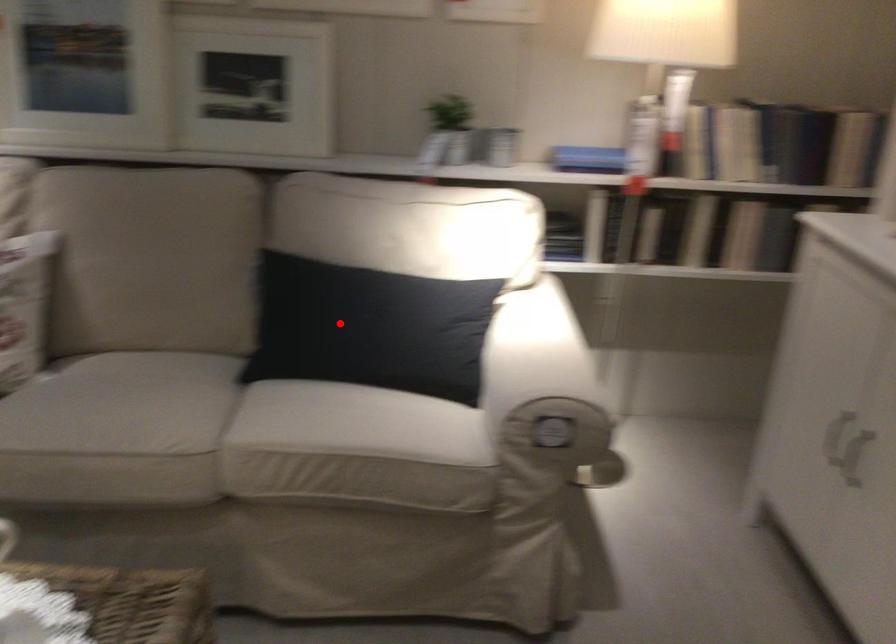
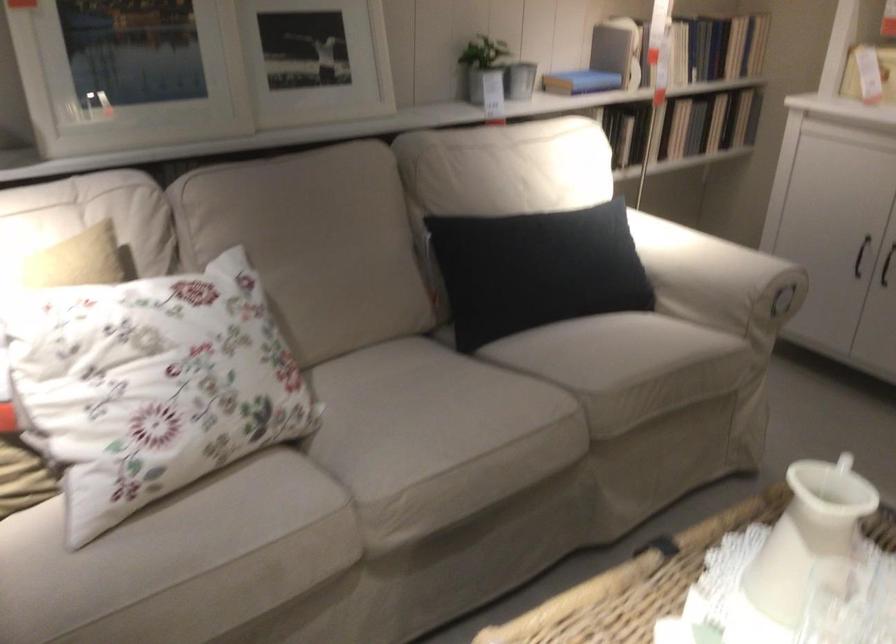
Locate, in the second image, the point that corresponds to the highlighted location in the first image.

(536, 270)